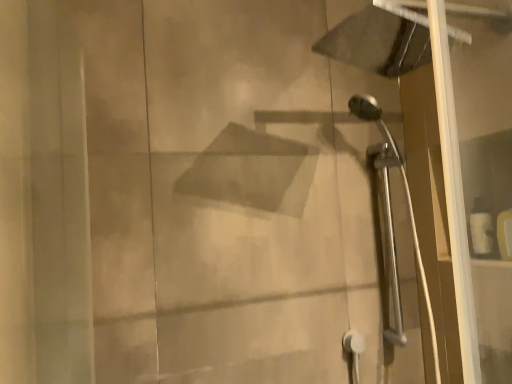
What do you see at coordinates (478, 188) in the screenshot? The height and width of the screenshot is (384, 512). I see `transparent glass door at right` at bounding box center [478, 188].

This screenshot has width=512, height=384. Find the location of `transparent glass door at right`. transparent glass door at right is located at coordinates (478, 188).

This screenshot has width=512, height=384. What are the coordinates of `transparent glass door at right` in the screenshot? It's located at (478, 188).